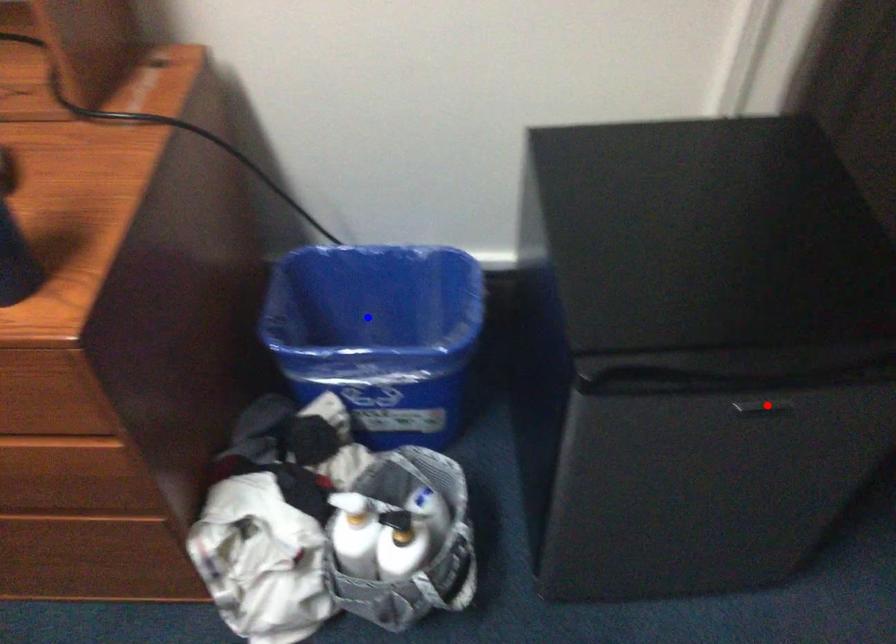
Question: Two points are marked on the image. Which point is closer to the camera?

Choices:
 (A) Blue point is closer.
 (B) Red point is closer.

Answer: (B)